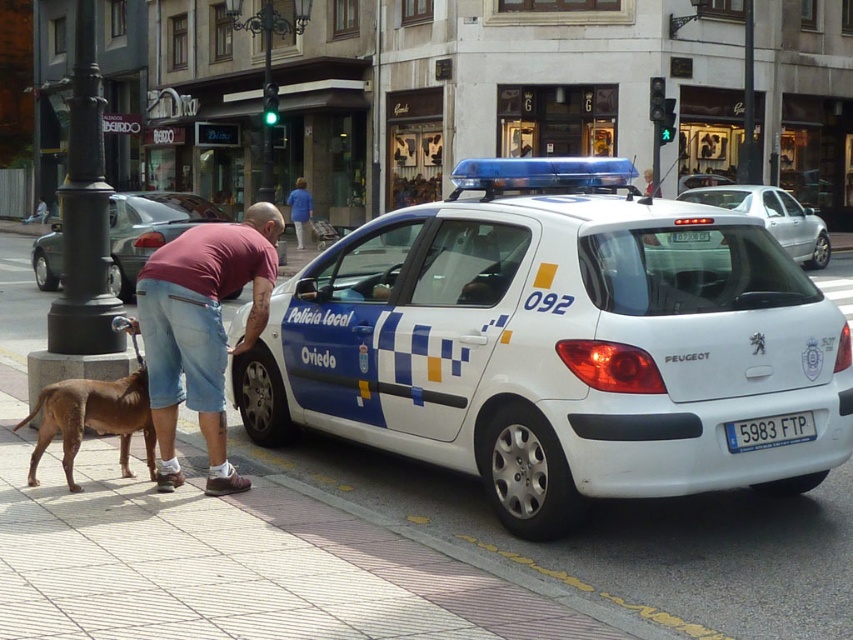
You are a delivery person trying to park your van behind the white glossy police car at center and the silver metallic sedan at center. Since your van is 6 feet tall, can you park there without hitting the ceiling?

The white glossy police car at center is much taller than the silver metallic sedan at center. However, the description does not provide specific height measurements for either vehicle. Without knowing the exact height of the police car or the sedan, it is impossible to determine if your van will fit under the ceiling. You should check the height restrictions or measure the available space before attempting to park.

You are a delivery driver who needs to park your van in the street scene shown. The van requires a parking space that is 2 meters wide. The brown smooth dog at lower left is in the way. Where should you park your van to avoid the dog?

The brown smooth dog at lower left is located at point (x=91, y=419). To avoid it, park your van in an area away from this coordinate, ensuring there is enough space for the van and compliance with parking regulations.

You are a pedestrian standing on the sidewalk. You see the brown smooth dog at lower left and the white plastic license plate at center. Which object is closer to you?

The brown smooth dog at lower left is closer to you since it is further to the viewer than the white plastic license plate at center.